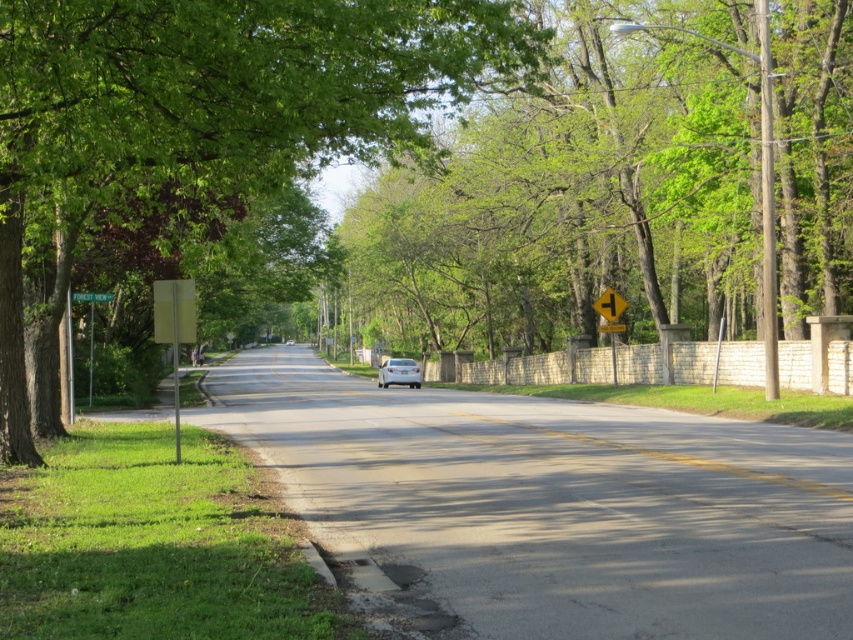
Is green leafy tree at left above yellow reflective plastic at center?

Correct, green leafy tree at left is located above yellow reflective plastic at center.

Who is shorter, green leafy tree at left or yellow reflective plastic at center?

yellow reflective plastic at center is shorter.

Is point (158, 22) behind point (593, 307)?

No, it is in front of (593, 307).

Where is `green leafy tree at left`? The image size is (853, 640). green leafy tree at left is located at coordinates (204, 116).

Between white glossy car at center and white glossy sedan at center, which one appears on the left side from the viewer's perspective?

white glossy sedan at center is more to the left.

Between white glossy car at center and white glossy sedan at center, which one is positioned lower?

white glossy car at center is below.

Consider the image. Who is more distant from viewer, (x=401, y=362) or (x=285, y=342)?

The point (x=285, y=342) is behind.

This screenshot has width=853, height=640. Find the location of `white glossy car at center`. white glossy car at center is located at coordinates (398, 372).

Can you confirm if green leafy tree at center is positioned above green leafy tree at left?

Yes, green leafy tree at center is above green leafy tree at left.

Is point (844, 227) farther from viewer compared to point (292, 148)?

Yes.

In order to click on green leafy tree at center in this screenshot , I will do (x=579, y=195).